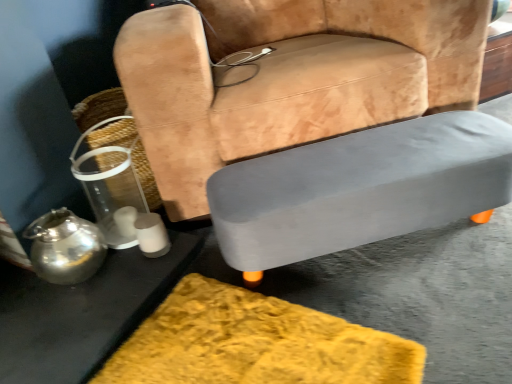
Identify the location of vacant space in front of shiny metallic teapot at lower left. This screenshot has height=384, width=512. (60, 326).